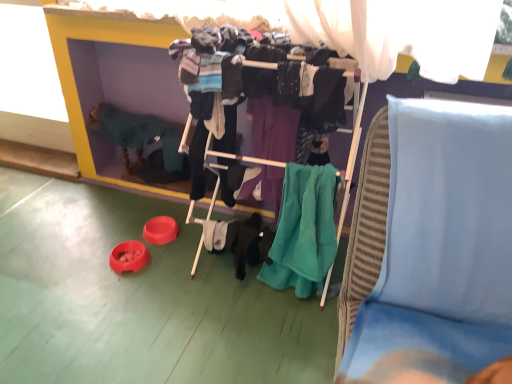
Find the location of `vacant space in front of teal soft towel at center`. vacant space in front of teal soft towel at center is located at coordinates (287, 349).